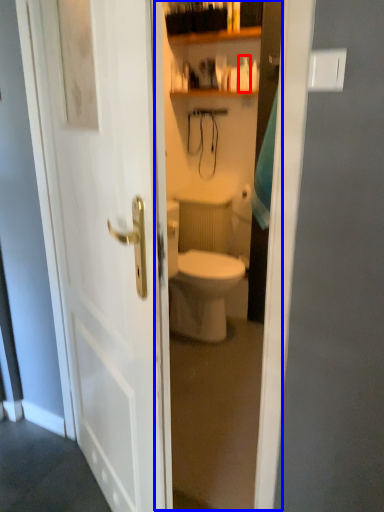
Question: Among these objects, which one is nearest to the camera, toiletry (highlighted by a red box) or glass door (highlighted by a blue box)?

Choices:
 (A) toiletry
 (B) glass door

Answer: (B)